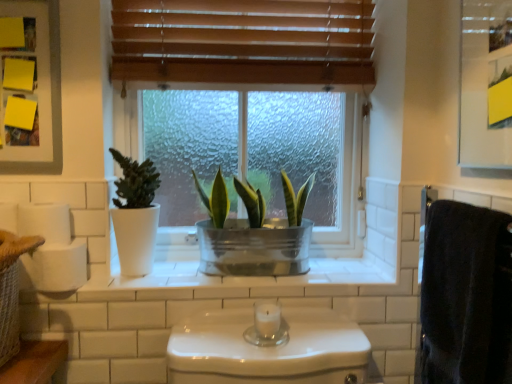
Question: Is matte white pot at left, the 2th houseplant positioned from the right, situated inside yellow paper at upper left, which is the second medicine cabinet from right to left, or outside?

Choices:
 (A) inside
 (B) outside

Answer: (B)

Question: Looking at their shapes, would you say matte white pot at left, the first houseplant from the left, is wider or thinner than yellow paper at upper left, which is the second medicine cabinet from right to left?

Choices:
 (A) thin
 (B) wide

Answer: (B)

Question: Estimate the real-world distances between objects in this image. Which object is farther from the black fuzzy bath towel at right?

Choices:
 (A) white matte toilet paper at left
 (B) metallic green plant at center, the first houseplant positioned from the right
 (C) metallic silver medicine cabinet at upper right, marked as the second medicine cabinet in a back-to-front arrangement
 (D) wooden blinds at upper center
 (E) yellow paper at upper left, arranged as the first medicine cabinet when viewed from the back

Answer: (E)

Question: Which of these objects is positioned closest to the yellow paper at upper left, which is the second medicine cabinet from right to left?

Choices:
 (A) metallic green plant at center, the second houseplant in the left-to-right sequence
 (B) white matte toilet paper at left
 (C) wooden blinds at upper center
 (D) metallic silver medicine cabinet at upper right, acting as the 1th medicine cabinet starting from the right
 (E) black fuzzy bath towel at right

Answer: (B)